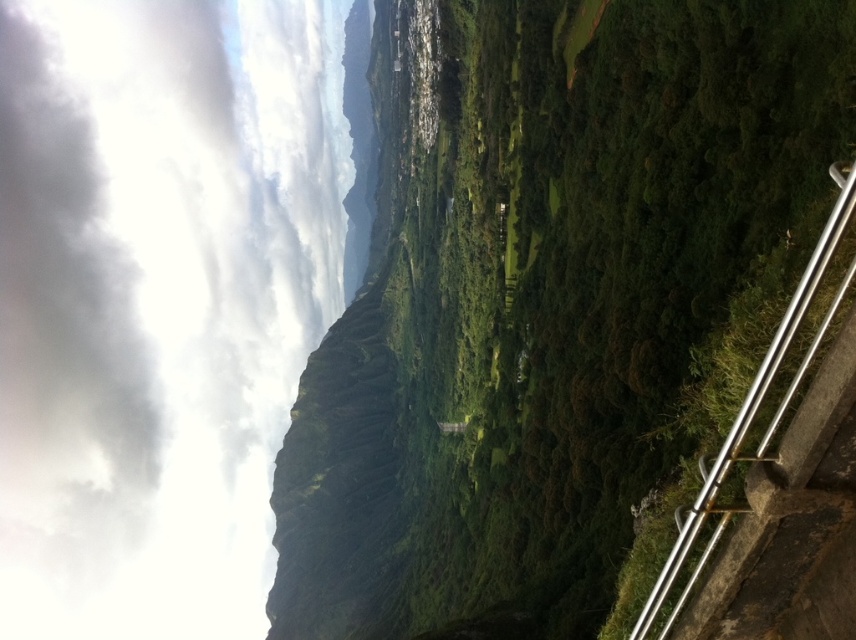
Question: Does green leafy vegetation at right appear on the right side of silver metallic rail at right?

Choices:
 (A) yes
 (B) no

Answer: (B)

Question: Is green leafy vegetation at right wider than silver metallic rail at right?

Choices:
 (A) yes
 (B) no

Answer: (A)

Question: Does green leafy vegetation at right appear on the left side of silver metallic rail at right?

Choices:
 (A) no
 (B) yes

Answer: (B)

Question: Which point is farther to the camera?

Choices:
 (A) green leafy vegetation at right
 (B) silver metallic rail at right

Answer: (A)